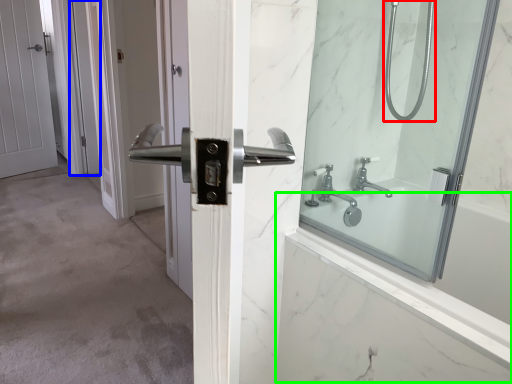
Question: Estimate the real-world distances between objects in this image. Which object is farther from shower head (highlighted by a red box), screen door (highlighted by a blue box) or bath (highlighted by a green box)?

Choices:
 (A) screen door
 (B) bath

Answer: (A)